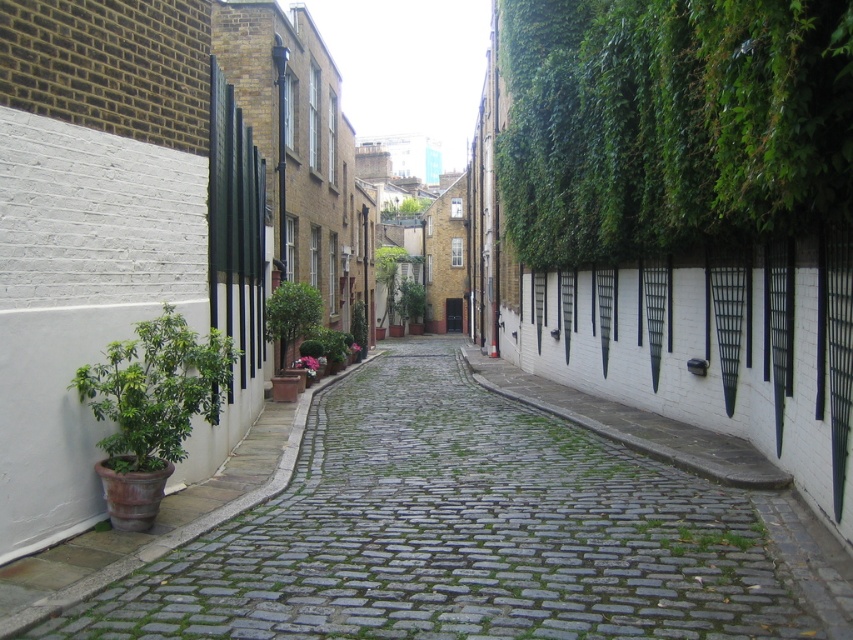
Where is `green grass at center`? The height and width of the screenshot is (640, 853). green grass at center is located at coordinates (583, 449).

Who is more forward, (544, 413) or (410, 310)?

Positioned in front is point (544, 413).

Between point (583, 440) and point (410, 307), which one is positioned in front?

Point (583, 440) is in front.

Find the location of a particular element. This screenshot has width=853, height=640. green grass at center is located at coordinates (583, 449).

Does green leafy ivy at right appear on the left side of green leafy plant at left?

No, green leafy ivy at right is not to the left of green leafy plant at left.

Is the position of green leafy ivy at right less distant than that of green leafy plant at left?

That is True.

What do you see at coordinates (671, 124) in the screenshot? This screenshot has width=853, height=640. I see `green leafy ivy at right` at bounding box center [671, 124].

Where is `green leafy ivy at right`? This screenshot has width=853, height=640. green leafy ivy at right is located at coordinates (671, 124).

Can you confirm if green leafy plant at left is shorter than green grass at center?

In fact, green leafy plant at left may be taller than green grass at center.

Can you confirm if green leafy plant at left is taller than green grass at center?

Indeed, green leafy plant at left has a greater height compared to green grass at center.

Who is more forward, (218, 349) or (590, 468)?

Positioned in front is point (218, 349).

At what (x,y) coordinates should I click in order to perform the action: click on green leafy plant at left. Please return your answer as a coordinate pair (x, y). Looking at the image, I should click on (155, 388).